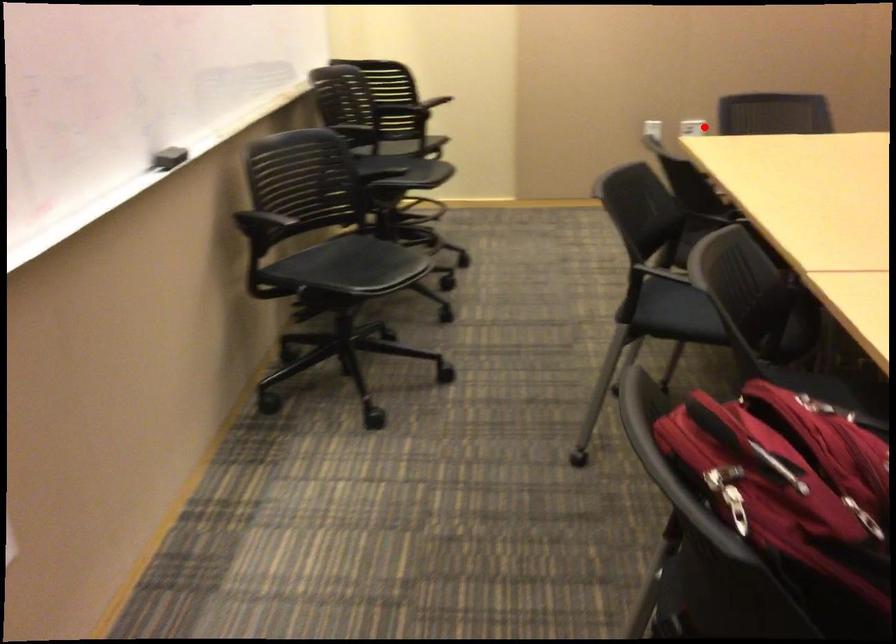
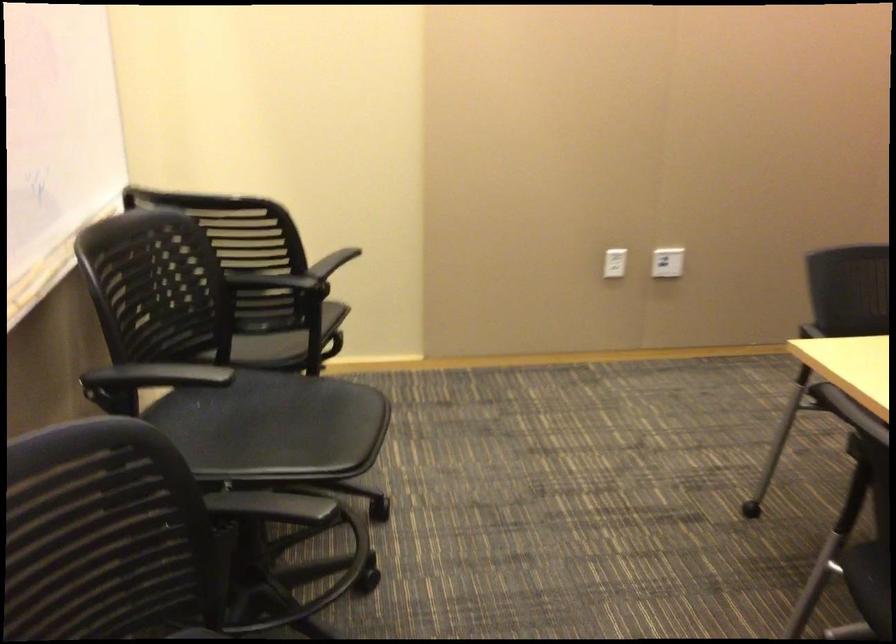
The point at the highlighted location is marked in the first image. Where is the corresponding point in the second image?

(667, 261)